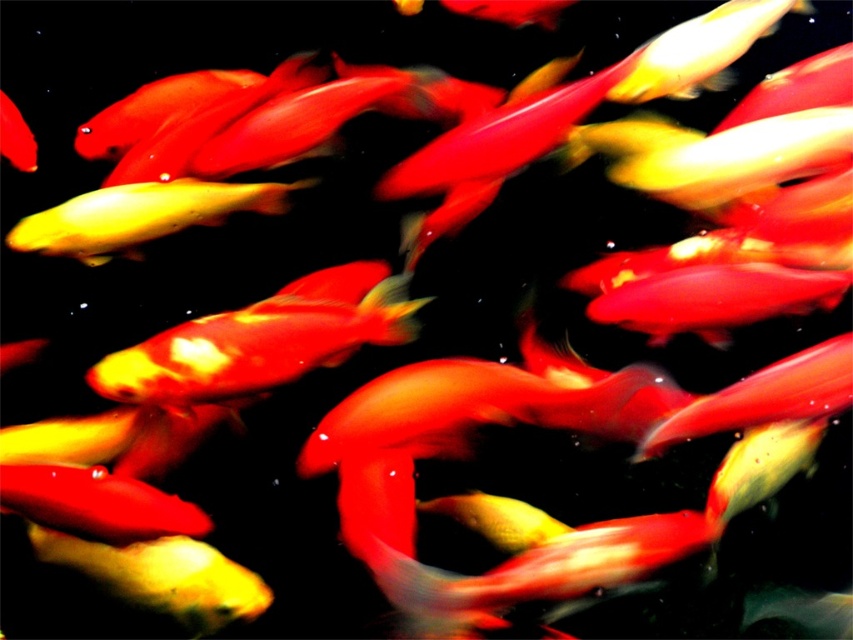
You are a photographer trying to capture a photo of the shiny goldfish at center and the yellow glossy fish at left. Which fish should you focus on first if you want to take a clear picture of both?

The shiny goldfish at center is below the yellow glossy fish at left, so you should focus on the yellow glossy fish at left first to ensure both are in focus.

You are a photographer trying to capture a koi fish. You see a yellow glossy fish at left represented by point [140,216]. Where should you aim your camera to focus on the fish?

You should aim your camera at point [140,216] to focus on the yellow glossy fish at left.

You are observing a group of fish in a pond. You see a shiny goldfish at center and a shiny red fish at center. Which fish is positioned to the right?

The shiny goldfish at center is positioned to the right of the shiny red fish at center.